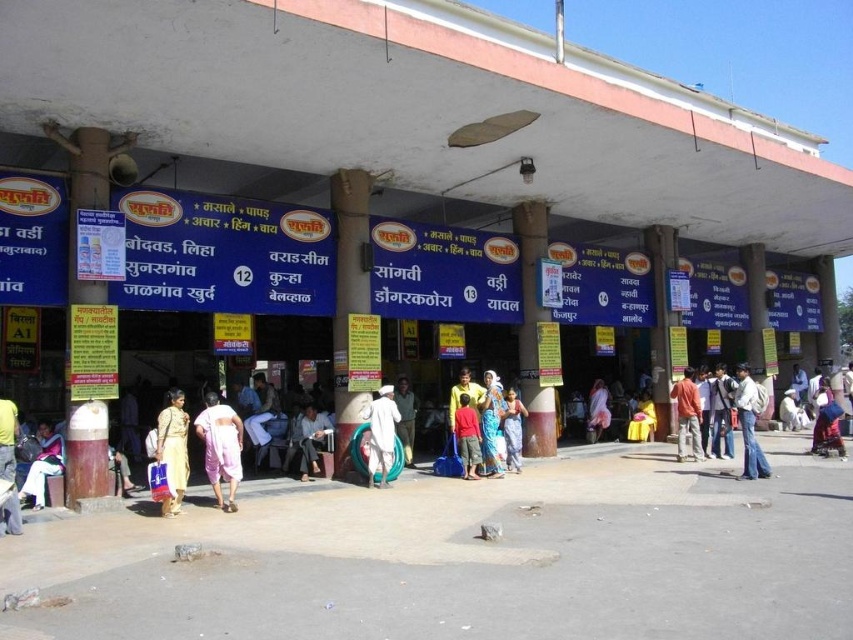
You are standing at the entrance of the train station and see a light brown fabric bag at center and a golden fabric dress at center. Which item is narrower?

The light brown fabric bag at center has a lesser width compared to the golden fabric dress at center, so the light brown fabric bag at center is narrower.